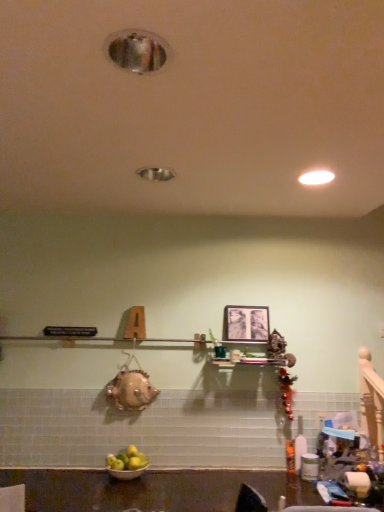
Question: From a real-world perspective, is matte black picture frame at center positioned above or below white glossy light fixture at upper right?

Choices:
 (A) above
 (B) below

Answer: (B)

Question: Considering their positions, is matte black picture frame at center located in front of or behind white glossy light fixture at upper right?

Choices:
 (A) behind
 (B) front

Answer: (A)

Question: Which object is the farthest from the white glossy bowl at lower center?

Choices:
 (A) matte black picture frame at center
 (B) white glossy light fixture at upper right
 (C) green matte apples at lower center

Answer: (B)

Question: Which object is the closest to the white glossy light fixture at upper right?

Choices:
 (A) green matte apples at lower center
 (B) white glossy bowl at lower center
 (C) matte black picture frame at center

Answer: (C)